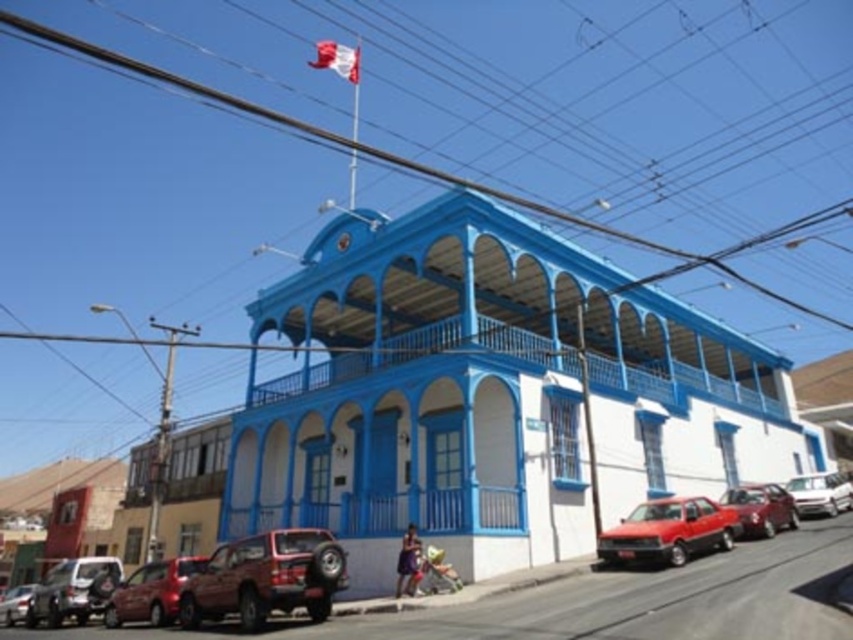
Question: Observing the image, what is the correct spatial positioning of matte red suv at lower left in reference to matte black suv at lower left?

Choices:
 (A) right
 (B) left

Answer: (A)

Question: Which point is closer to the camera?

Choices:
 (A) matte black suv at lower left
 (B) metallic silver car at lower left
 (C) red and white fabric flag at upper center

Answer: (A)

Question: Which point is farther from the camera taking this photo?

Choices:
 (A) (839, 499)
 (B) (218, 600)
 (C) (693, 531)

Answer: (A)

Question: Observing the image, what is the correct spatial positioning of shiny red car at lower right in reference to metallic silver car at lower left?

Choices:
 (A) below
 (B) above

Answer: (B)

Question: Is matte black suv at lower left positioned in front of metallic silver car at lower left?

Choices:
 (A) no
 (B) yes

Answer: (B)

Question: Which object is farther from the camera taking this photo?

Choices:
 (A) metallic red suv at lower left
 (B) metallic silver car at lower left
 (C) red and white fabric flag at upper center
 (D) silver metallic sedan at right

Answer: (C)